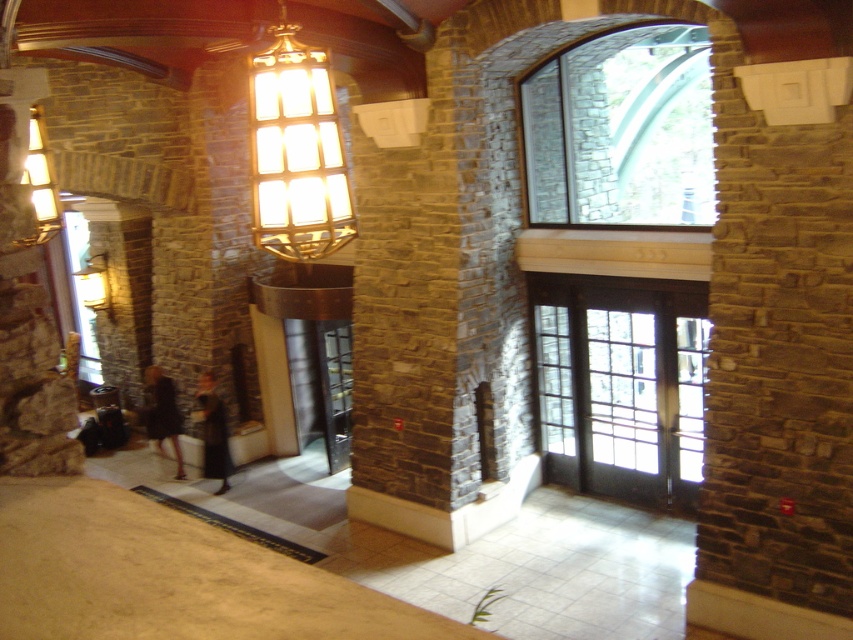
Question: Which object is farther from the camera taking this photo?

Choices:
 (A) dark brown dress at lower left
 (B) glass door at center
 (C) gold metallic lamp at upper center
 (D) dark brown leather jacket at lower left

Answer: (A)

Question: Which point is closer to the camera taking this photo?

Choices:
 (A) (270, 209)
 (B) (647, 291)
 (C) (88, 262)
 (D) (688, 156)

Answer: (A)

Question: Estimate the real-world distances between objects in this image. Which object is closer to the clear glass window at upper center?

Choices:
 (A) black glass elevator at center
 (B) gold metallic lamp at upper center

Answer: (A)

Question: From the image, what is the correct spatial relationship of clear glass window at upper center in relation to glass door at center?

Choices:
 (A) below
 (B) above

Answer: (B)

Question: Does dark brown dress at lower left appear over matte gold lamp at left?

Choices:
 (A) no
 (B) yes

Answer: (A)

Question: Can you confirm if matte gold light fixture at upper left is positioned to the right of dark brown dress at lower left?

Choices:
 (A) no
 (B) yes

Answer: (B)